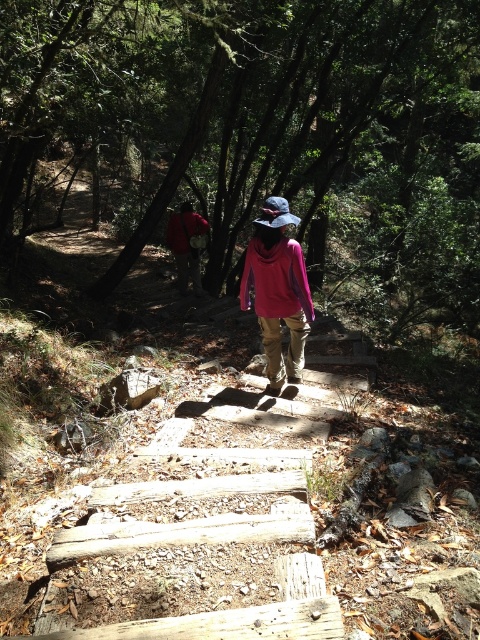
Is pink matte jacket at center closer to camera compared to red fabric backpack at center?

Yes, pink matte jacket at center is in front of red fabric backpack at center.

You are a GUI agent. You are given a task and a screenshot of the screen. Output one action in this format:
    pyautogui.click(x=<x>, y=<y>)
    Task: Click on the pink matte jacket at center
    
    Given the screenshot: What is the action you would take?
    pyautogui.click(x=277, y=291)